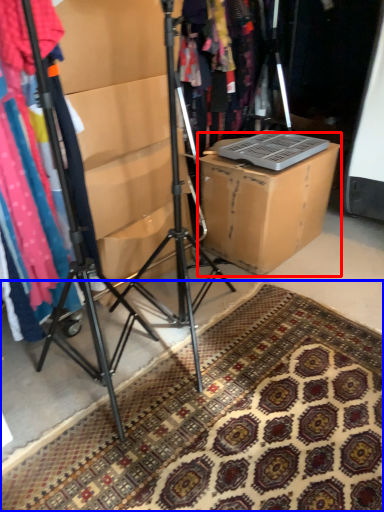
Question: Which of the following is the farthest to the observer, cardboard box (highlighted by a red box) or doormat (highlighted by a blue box)?

Choices:
 (A) cardboard box
 (B) doormat

Answer: (A)